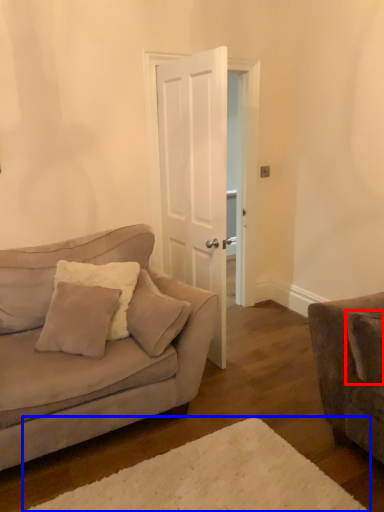
Question: Among these objects, which one is farthest to the camera, pillow (highlighted by a red box) or plain (highlighted by a blue box)?

Choices:
 (A) pillow
 (B) plain

Answer: (A)